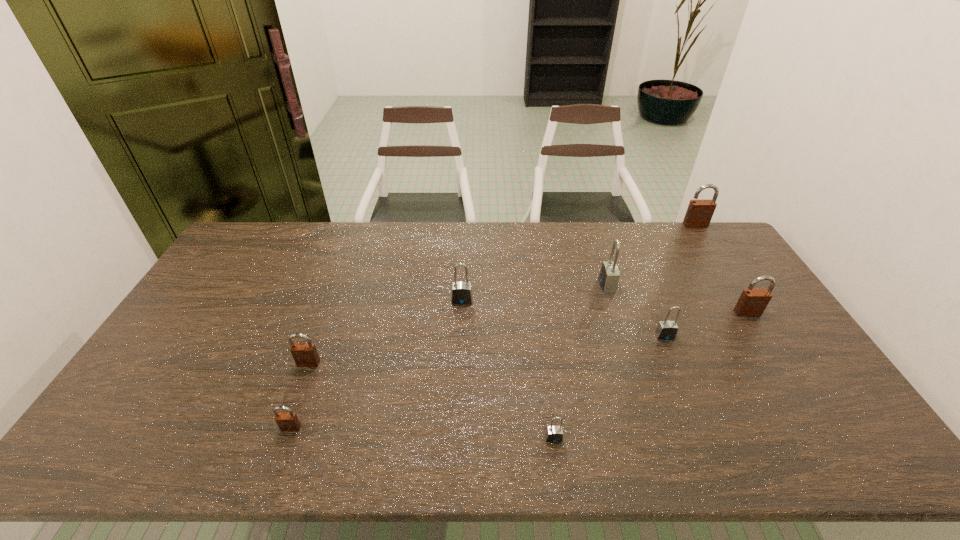
At what (x,y) coordinates should I click in order to perform the action: click on vacant area situated on the shackle of the second biggest gray padlock. Please return your answer as a coordinate pair (x, y). Image resolution: width=960 pixels, height=540 pixels. Looking at the image, I should click on (461, 326).

Identify the location of free point located on the front-facing side of the fifth nearest object. (774, 355).

Where is `free region located on the shackle of the fourth nearest padlock`? The width and height of the screenshot is (960, 540). free region located on the shackle of the fourth nearest padlock is located at coordinates (715, 456).

You are a GUI agent. You are given a task and a screenshot of the screen. Output one action in this format:
    pyautogui.click(x=<x>, y=<y>)
    Task: Click on the free space located on the front-facing side of the third nearest padlock
    
    Given the screenshot: What is the action you would take?
    pyautogui.click(x=279, y=442)

Where is `object at the far edge`? object at the far edge is located at coordinates (699, 213).

Locate an element on the screen. object situated at the far right corner is located at coordinates point(699,213).

At what (x,y) coordinates should I click in order to perform the action: click on vacant area at the far edge. Please return your answer as a coordinate pair (x, y). Looking at the image, I should click on (332, 224).

In the image, there is a desktop. Where is `vacant space at the near edge`? vacant space at the near edge is located at coordinates (319, 432).

I want to click on free space at the right edge, so click(834, 406).

Where is `vacant area at the far left corner`? Image resolution: width=960 pixels, height=540 pixels. vacant area at the far left corner is located at coordinates (236, 255).